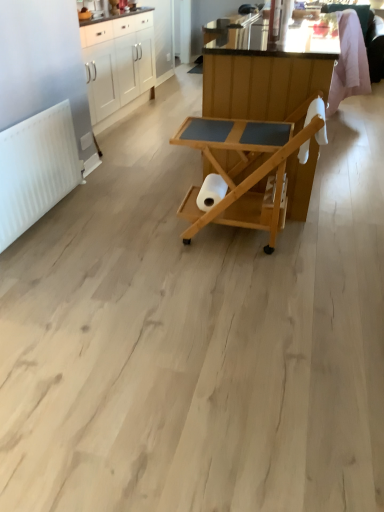
Question: Is white matte toilet paper at center aimed at natural wood serving cart at center, placed as the second table when sorted from back to front?

Choices:
 (A) no
 (B) yes

Answer: (B)

Question: Is white matte toilet paper at center next to natural wood serving cart at center, the first table viewed from the front?

Choices:
 (A) no
 (B) yes

Answer: (A)

Question: Is white matte toilet paper at center facing away from natural wood serving cart at center, placed as the second table when sorted from back to front?

Choices:
 (A) yes
 (B) no

Answer: (A)

Question: Is white matte toilet paper at center positioned in front of natural wood serving cart at center, the first table viewed from the front?

Choices:
 (A) no
 (B) yes

Answer: (A)

Question: Is white matte toilet paper at center thinner than natural wood serving cart at center, placed as the second table when sorted from back to front?

Choices:
 (A) no
 (B) yes

Answer: (B)

Question: Is white glossy cabinets at upper left taller or shorter than natural wood serving cart at center, marked as the first table in a back-to-front arrangement?

Choices:
 (A) tall
 (B) short

Answer: (A)

Question: From a real-world perspective, is white glossy cabinets at upper left above or below natural wood serving cart at center, marked as the first table in a back-to-front arrangement?

Choices:
 (A) above
 (B) below

Answer: (B)

Question: Would you say white glossy cabinets at upper left is inside or outside natural wood serving cart at center, the second table positioned from the front?

Choices:
 (A) outside
 (B) inside

Answer: (A)

Question: Relative to natural wood serving cart at center, the second table positioned from the front, is white glossy cabinets at upper left in front or behind?

Choices:
 (A) behind
 (B) front

Answer: (A)

Question: Looking at the image, does white matte radiator at left seem bigger or smaller compared to natural wood serving cart at center, marked as the first table in a back-to-front arrangement?

Choices:
 (A) big
 (B) small

Answer: (B)

Question: From the image's perspective, relative to natural wood serving cart at center, the second table positioned from the front, is white matte radiator at left above or below?

Choices:
 (A) below
 (B) above

Answer: (A)

Question: Visually, is white matte radiator at left positioned to the left or to the right of natural wood serving cart at center, the second table positioned from the front?

Choices:
 (A) left
 (B) right

Answer: (A)

Question: Considering their positions, is white matte radiator at left located in front of or behind natural wood serving cart at center, marked as the first table in a back-to-front arrangement?

Choices:
 (A) front
 (B) behind

Answer: (A)

Question: Is natural wood serving cart at center, placed as the second table when sorted from back to front, taller or shorter than white matte radiator at left?

Choices:
 (A) short
 (B) tall

Answer: (B)

Question: Is natural wood serving cart at center, the first table viewed from the front, in front of or behind white matte radiator at left in the image?

Choices:
 (A) behind
 (B) front

Answer: (B)